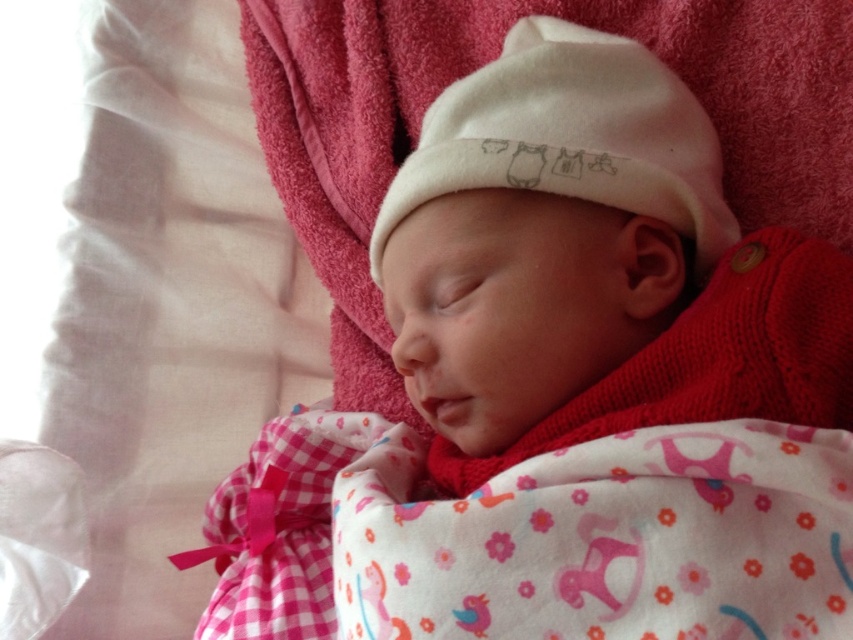
Between white soft hat at center and white cotton hat at center, which one appears on the right side from the viewer's perspective?

white soft hat at center is more to the right.

Is point (511, 304) positioned behind point (718, 221)?

No.

Between point (773, 392) and point (703, 253), which one is positioned in front?

Positioned in front is point (773, 392).

This screenshot has width=853, height=640. Identify the location of white soft hat at center. (592, 264).